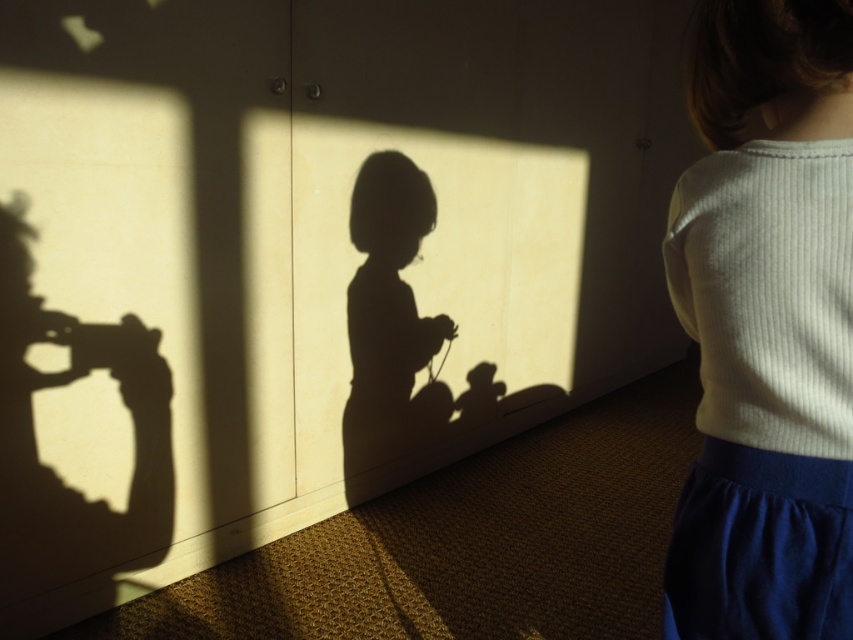
Question: Which point is closer to the camera?

Choices:
 (A) white ribbed sweater at upper right
 (B) matte black camera at left

Answer: (A)

Question: Does matte black camera at left appear on the left side of silhouette figure at center?

Choices:
 (A) no
 (B) yes

Answer: (B)

Question: Is matte black camera at left further to camera compared to silhouette figure at center?

Choices:
 (A) yes
 (B) no

Answer: (B)

Question: Which is nearer to the matte black camera at left?

Choices:
 (A) white ribbed sweater at upper right
 (B) silhouette figure at center

Answer: (B)

Question: Which point is closer to the camera?

Choices:
 (A) matte black camera at left
 (B) silhouette figure at center

Answer: (A)

Question: Is white ribbed sweater at upper right closer to camera compared to silhouette figure at center?

Choices:
 (A) no
 (B) yes

Answer: (B)